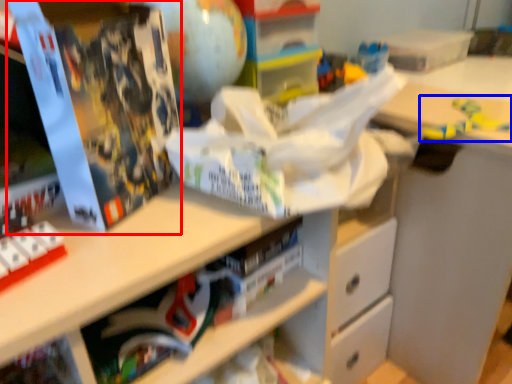
Question: Among these objects, which one is nearest to the camera, paperback book (highlighted by a red box) or toy (highlighted by a blue box)?

Choices:
 (A) paperback book
 (B) toy

Answer: (A)